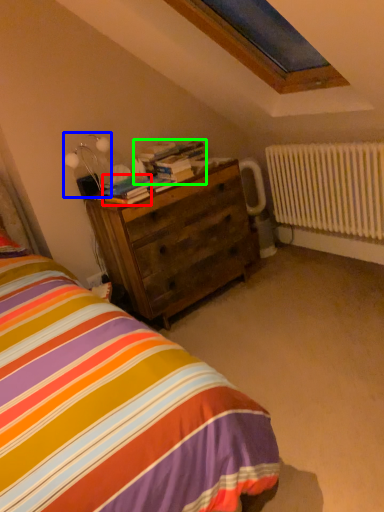
Question: Estimate the real-world distances between objects in this image. Which object is farther from book (highlighted by a red box), table lamp (highlighted by a blue box) or book (highlighted by a green box)?

Choices:
 (A) table lamp
 (B) book

Answer: (A)